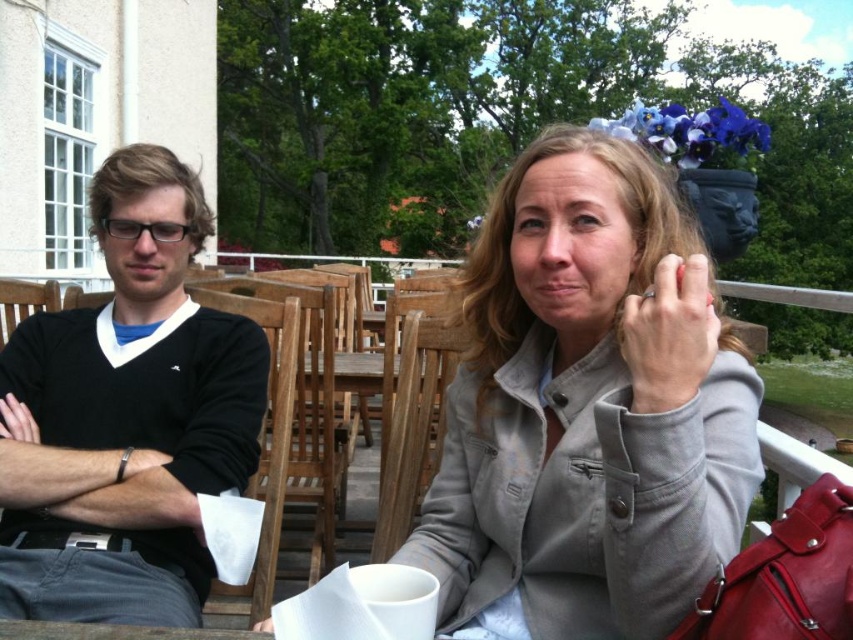
You are a photographer trying to capture a candid shot of both the gray matte jacket at center and the black sweater at left. Since you want to ensure both are visible in the frame, can you determine which clothing item is positioned higher in the image?

The gray matte jacket at center is located above the black sweater at left, so it is positioned higher in the image.